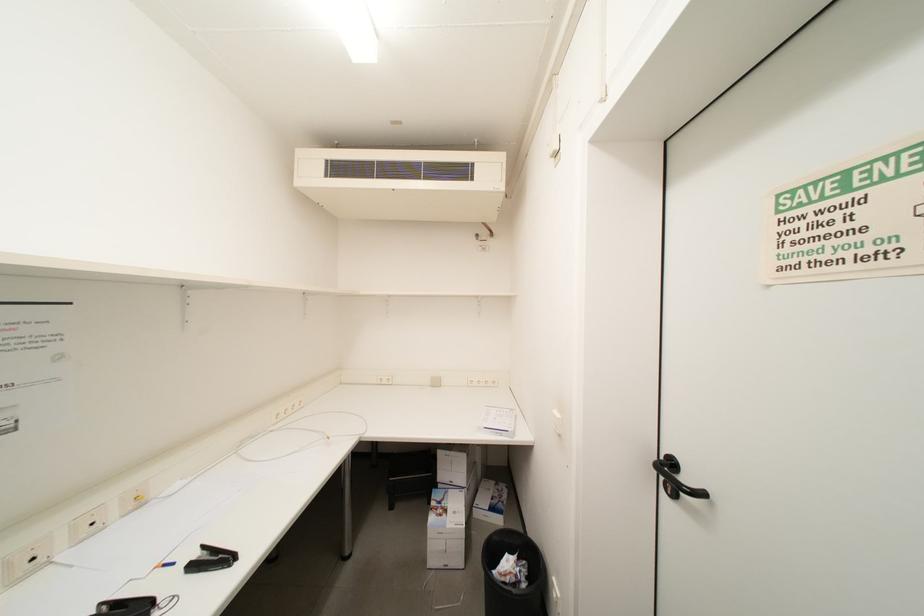
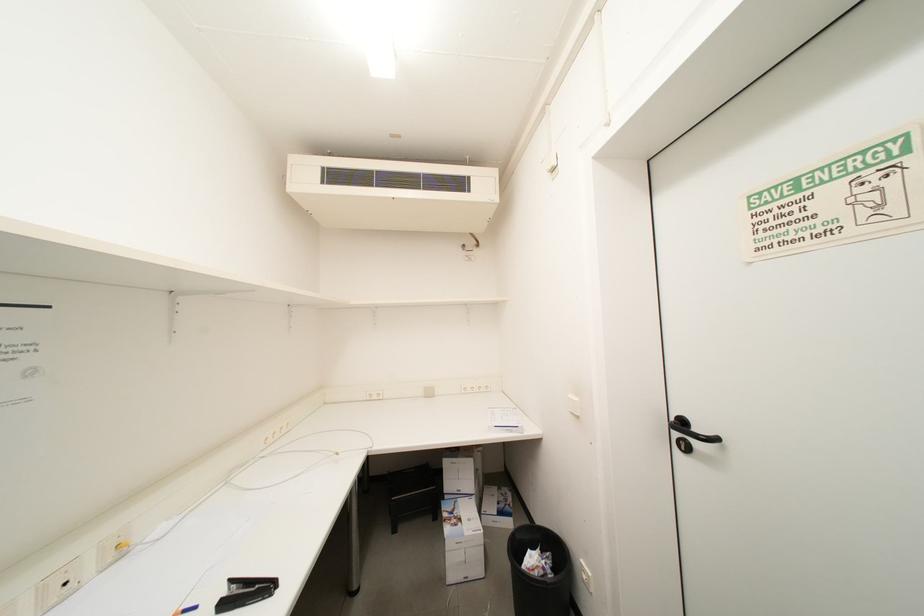
Question: How did the camera likely rotate?

Choices:
 (A) Left
 (B) Right
 (C) Up
 (D) Down

Answer: (B)